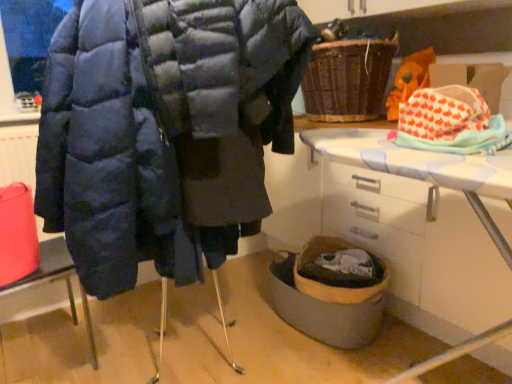
Question: Considering the relative sizes of matte black coat at left and white plastic table at lower right in the image provided, is matte black coat at left shorter than white plastic table at lower right?

Choices:
 (A) no
 (B) yes

Answer: (B)

Question: Is matte black coat at left wider than white plastic table at lower right?

Choices:
 (A) yes
 (B) no

Answer: (B)

Question: Can you confirm if matte black coat at left is positioned to the left of white plastic table at lower right?

Choices:
 (A) no
 (B) yes

Answer: (B)

Question: Is matte black coat at left not inside white plastic table at lower right?

Choices:
 (A) yes
 (B) no

Answer: (A)

Question: Is matte black coat at left at the right side of white plastic table at lower right?

Choices:
 (A) no
 (B) yes

Answer: (A)

Question: Is wooden woven basket at lower center bigger or smaller than white plastic table at lower right?

Choices:
 (A) small
 (B) big

Answer: (A)

Question: Visually, is wooden woven basket at lower center positioned to the left or to the right of white plastic table at lower right?

Choices:
 (A) right
 (B) left

Answer: (B)

Question: In terms of width, does wooden woven basket at lower center look wider or thinner when compared to white plastic table at lower right?

Choices:
 (A) wide
 (B) thin

Answer: (B)

Question: Is wooden woven basket at lower center inside or outside of white plastic table at lower right?

Choices:
 (A) inside
 (B) outside

Answer: (B)

Question: From the image's perspective, is woven brown basket at upper center located above or below matte blue puffer jacket at center?

Choices:
 (A) above
 (B) below

Answer: (A)

Question: Would you say woven brown basket at upper center is to the left or to the right of matte blue puffer jacket at center in the picture?

Choices:
 (A) left
 (B) right

Answer: (B)

Question: From a real-world perspective, is woven brown basket at upper center positioned above or below matte blue puffer jacket at center?

Choices:
 (A) below
 (B) above

Answer: (B)

Question: Is point (322, 102) closer or farther from the camera than point (292, 51)?

Choices:
 (A) farther
 (B) closer

Answer: (A)

Question: From a real-world perspective, is matte blue puffer jacket at center positioned above or below matte black coat at left?

Choices:
 (A) below
 (B) above

Answer: (B)

Question: From the image's perspective, is matte blue puffer jacket at center located above or below matte black coat at left?

Choices:
 (A) below
 (B) above

Answer: (B)